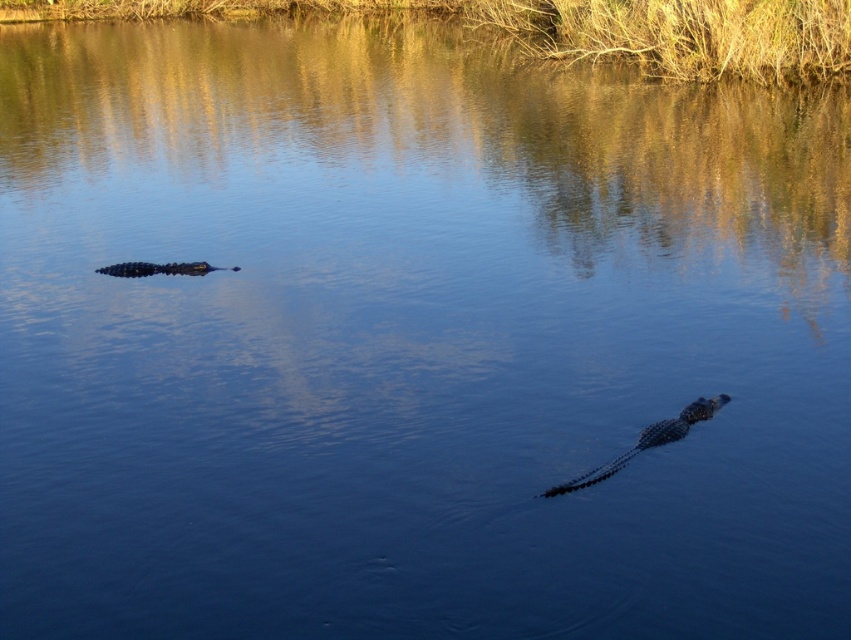
You are a wildlife photographer who wants to capture a photo of both the shiny dark green crocodile at center and the shiny black crocodile at left in the same frame. Your camera has a maximum focal length that allows capturing objects up to 35 feet apart. Can you include both crocodiles in a single photo without moving your position?

The shiny dark green crocodile at center and the shiny black crocodile at left are 38.14 feet apart. Since the distance between them exceeds the camera maximum focal length of 35 feet, you cannot include both crocodiles in a single photo without moving your position.

You are a wildlife photographer aiming to capture a closeup shot of the shiny dark green crocodile at center. Your camera has a maximum zoom range of 25 feet. Can you get a clear closeup shot without moving closer?

The shiny dark green crocodile at center is 33.82 feet away from camera. Since the camera can only zoom up to 25 feet, you cannot get a clear closeup shot without moving closer.

You are a photographer aiming to capture both the shiny dark green crocodile at center and the shiny black crocodile at left in a single shot. Based on their positions, which crocodile would appear closer to the camera in the photo?

The shiny dark green crocodile at center would appear closer to the camera because it is positioned in front of the shiny black crocodile at left.